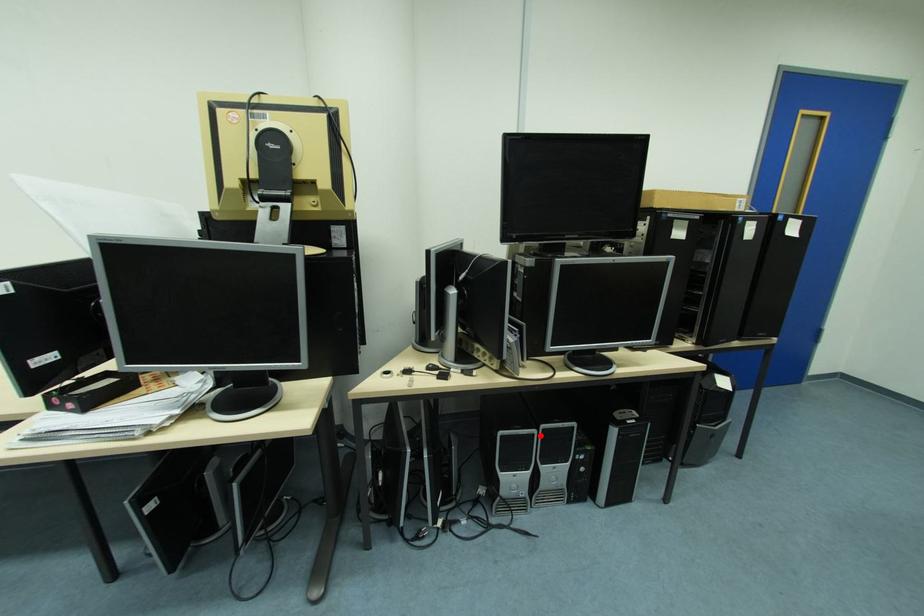
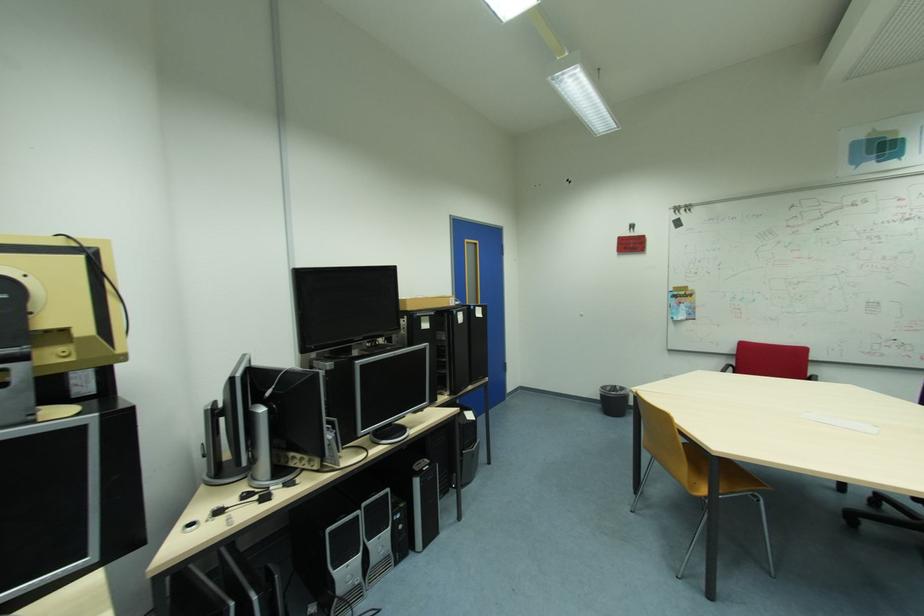
The point at the highlighted location is marked in the first image. Where is the corresponding point in the second image?

(365, 517)